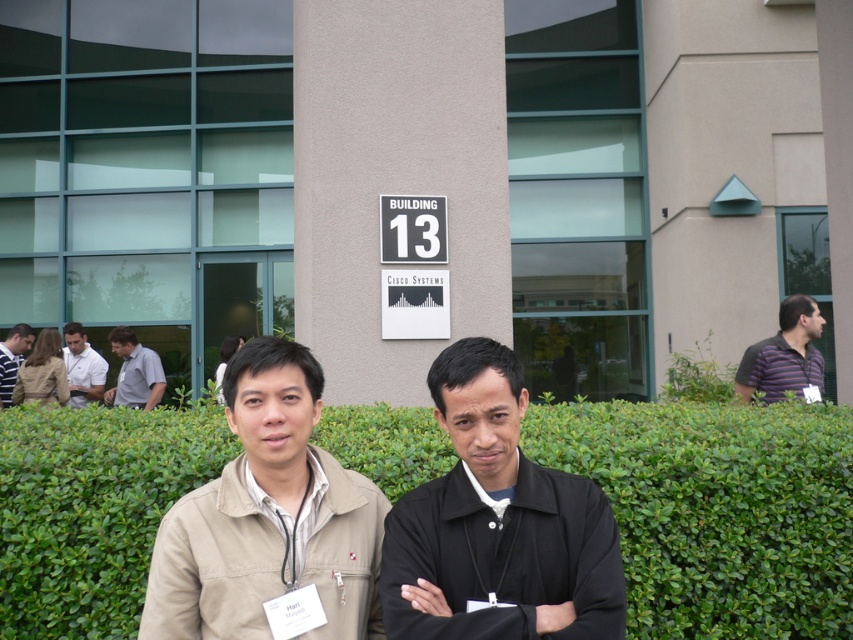
You are a drone operator planning to take a photo of the green leafy hedge at center from above. What is the exact 2D coordinate point where you should focus your camera to ensure the hedge is centered in the photo?

The exact 2D coordinate point to focus the camera on the green leafy hedge at center is at point [718,509].

You are a security guard at Cisco Systems and need to verify the positions of two attendees based on their clothing. The beige fabric jacket at center and the light gray shirt at left are part of their outfits. According to the scene, which clothing item is located to the right of the other?

The beige fabric jacket at center is positioned on the right side of the light gray shirt at left, so the beige fabric jacket at center is to the right of the light gray shirt at left.